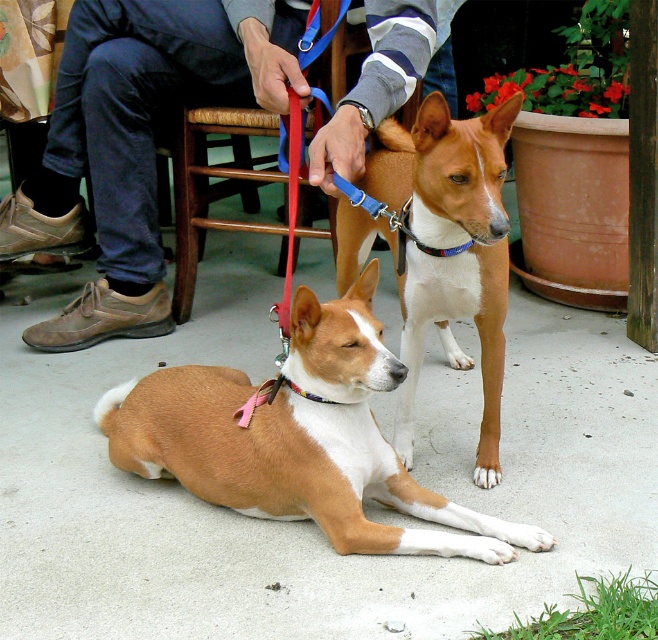
Does brown/white fur dog at center appear over wooden chair at center?

No, brown/white fur dog at center is not above wooden chair at center.

Does point (424, 106) come in front of point (188, 278)?

Yes, it is in front of point (188, 278).

I want to click on brown/white fur dog at center, so click(440, 248).

From the picture: Which of these two, wooden chair at center or multicolored fabric neckband at center, stands taller?

wooden chair at center is taller.

Can you confirm if wooden chair at center is wider than multicolored fabric neckband at center?

Indeed, wooden chair at center has a greater width compared to multicolored fabric neckband at center.

Which is behind, point (190, 272) or point (272, 392)?

The point (190, 272) is behind.

Identify the location of wooden chair at center. This screenshot has width=658, height=640. (213, 188).

Can you confirm if brown leather shoes at lower left is thinner than brown/white fur dog at center?

No, brown leather shoes at lower left is not thinner than brown/white fur dog at center.

Measure the distance between brown leather shoes at lower left and camera.

They are 7.72 feet apart.

At what (x,y) coordinates should I click in order to perform the action: click on brown leather shoes at lower left. Please return your answer as a coordinate pair (x, y). Looking at the image, I should click on tap(138, 140).